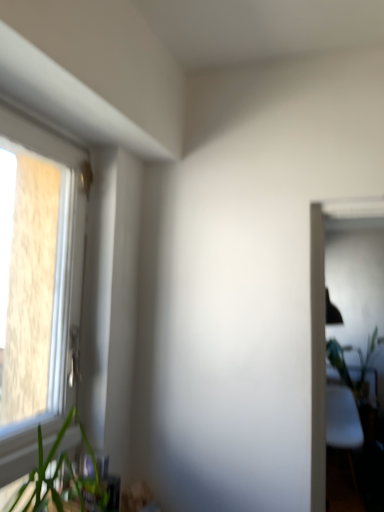
Question: Is green leafy plant at lower left closer to camera compared to green leafy plant at right?

Choices:
 (A) no
 (B) yes

Answer: (B)

Question: Does green leafy plant at lower left have a greater width compared to green leafy plant at right?

Choices:
 (A) no
 (B) yes

Answer: (A)

Question: From the image's perspective, does green leafy plant at lower left appear lower than green leafy plant at right?

Choices:
 (A) no
 (B) yes

Answer: (A)

Question: Is green leafy plant at lower left shorter than green leafy plant at right?

Choices:
 (A) yes
 (B) no

Answer: (A)

Question: Considering the relative positions of green leafy plant at lower left and green leafy plant at right in the image provided, is green leafy plant at lower left to the right of green leafy plant at right from the viewer's perspective?

Choices:
 (A) yes
 (B) no

Answer: (B)

Question: Considering the positions of white plastic window at left and green leafy plant at right in the image, is white plastic window at left wider or thinner than green leafy plant at right?

Choices:
 (A) wide
 (B) thin

Answer: (B)

Question: Is point (23, 461) closer or farther from the camera than point (332, 351)?

Choices:
 (A) closer
 (B) farther

Answer: (A)

Question: In terms of height, does white plastic window at left look taller or shorter compared to green leafy plant at right?

Choices:
 (A) tall
 (B) short

Answer: (A)

Question: Is white plastic window at left in front of or behind green leafy plant at right in the image?

Choices:
 (A) behind
 (B) front

Answer: (B)

Question: In terms of size, does green leafy plant at lower left appear bigger or smaller than green leafy plant at right?

Choices:
 (A) big
 (B) small

Answer: (B)

Question: Considering their positions, is green leafy plant at lower left located in front of or behind green leafy plant at right?

Choices:
 (A) front
 (B) behind

Answer: (A)

Question: Is green leafy plant at lower left taller or shorter than green leafy plant at right?

Choices:
 (A) tall
 (B) short

Answer: (B)

Question: From the image's perspective, relative to green leafy plant at right, is green leafy plant at lower left above or below?

Choices:
 (A) below
 (B) above

Answer: (B)

Question: Based on their positions, is green leafy plant at right located to the left or right of white plastic window at left?

Choices:
 (A) right
 (B) left

Answer: (A)

Question: Is green leafy plant at right wider or thinner than white plastic window at left?

Choices:
 (A) thin
 (B) wide

Answer: (B)